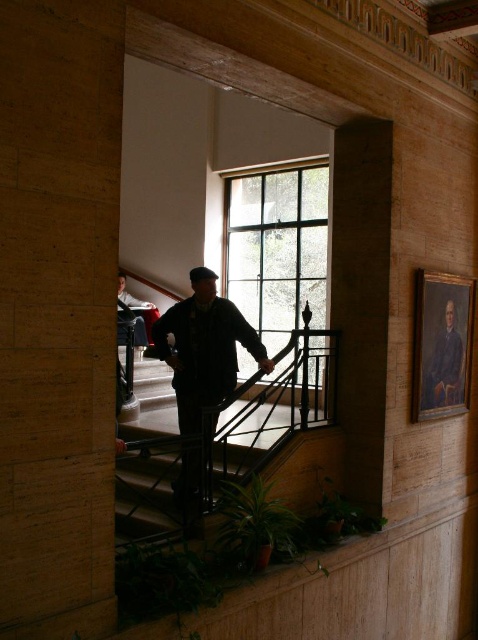
What do you see at coordinates (204, 348) in the screenshot?
I see `dark green fabric jacket at center` at bounding box center [204, 348].

Can you confirm if dark green fabric jacket at center is positioned to the left of dark blue canvas portrait at right?

Indeed, dark green fabric jacket at center is positioned on the left side of dark blue canvas portrait at right.

The image size is (478, 640). In order to click on dark green fabric jacket at center in this screenshot , I will do `click(204, 348)`.

Does oil painting at upper right have a lesser height compared to dark blue jeans at lower left?

No, oil painting at upper right is not shorter than dark blue jeans at lower left.

Does oil painting at upper right have a smaller size compared to dark blue jeans at lower left?

Yes.

Between point (437, 289) and point (137, 308), which one is positioned behind?

Positioned behind is point (137, 308).

Locate an element on the screen. The image size is (478, 640). oil painting at upper right is located at coordinates (442, 344).

Is dark blue canvas portrait at right smaller than dark blue jeans at lower left?

Indeed, dark blue canvas portrait at right has a smaller size compared to dark blue jeans at lower left.

Which of these two, dark blue canvas portrait at right or dark blue jeans at lower left, stands shorter?

Standing shorter between the two is dark blue canvas portrait at right.

I want to click on dark blue canvas portrait at right, so click(x=445, y=364).

This screenshot has width=478, height=640. In order to click on dark blue canvas portrait at right in this screenshot , I will do `click(445, 364)`.